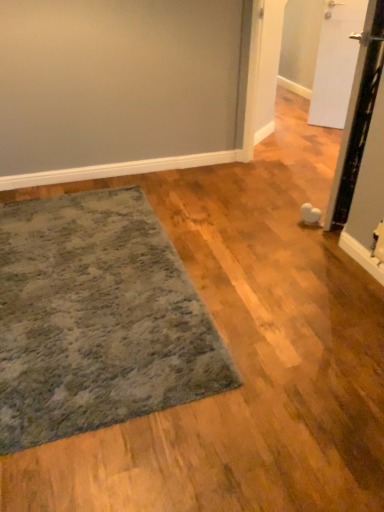
Question: Is white matte door at upper right, placed as the 2th door when sorted from front to back, taller or shorter than white glossy door at right, acting as the first door starting from the front?

Choices:
 (A) tall
 (B) short

Answer: (B)

Question: From the image's perspective, is white matte door at upper right, placed as the 2th door when sorted from front to back, above or below white glossy door at right, acting as the first door starting from the front?

Choices:
 (A) above
 (B) below

Answer: (A)

Question: Considering the real-world distances, which object is farthest from the textured gray rug at lower left?

Choices:
 (A) white matte door at upper right, acting as the first door starting from the back
 (B) white glossy door at right, acting as the first door starting from the front

Answer: (A)

Question: Which is nearer to the white glossy door at right, the second door from the back?

Choices:
 (A) textured gray rug at lower left
 (B) white matte door at upper right, acting as the first door starting from the back

Answer: (A)